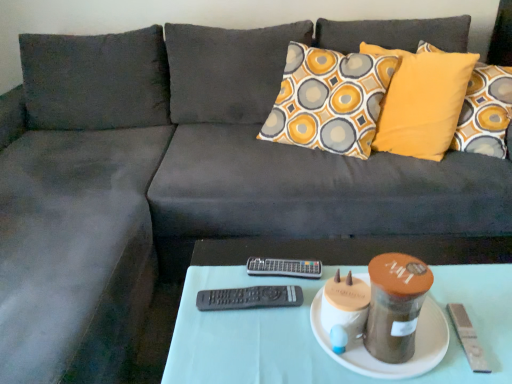
At what (x,y) coordinates should I click in order to perform the action: click on free spot behind white ceramic plate at center. Please return your answer as a coordinate pair (x, y). The image size is (512, 384). Looking at the image, I should click on (350, 253).